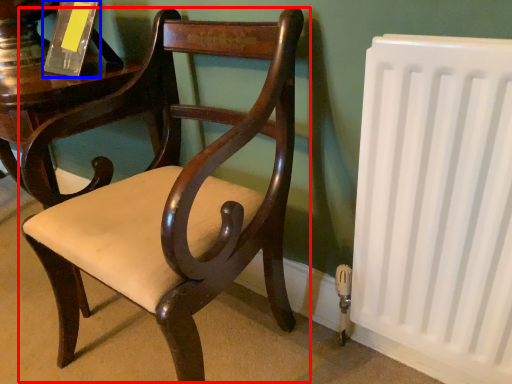
Question: Which object appears farthest to the camera in this image, chair (highlighted by a red box) or paperback book (highlighted by a blue box)?

Choices:
 (A) chair
 (B) paperback book

Answer: (B)